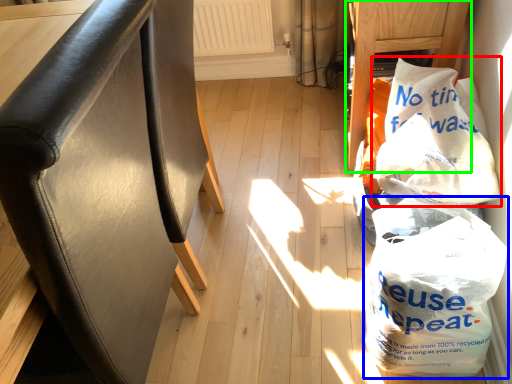
Question: Which object is positioned farthest from plastic bag (highlighted by a red box)? Select from plastic bag (highlighted by a blue box) and furniture (highlighted by a green box).

Choices:
 (A) plastic bag
 (B) furniture

Answer: (B)